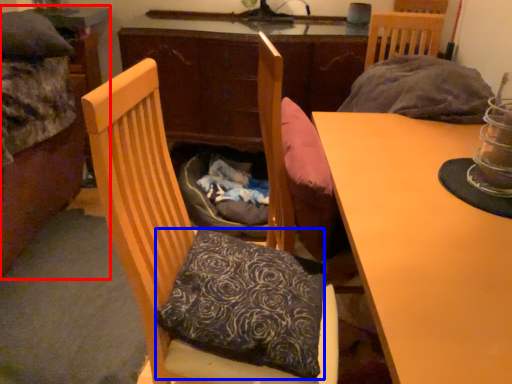
Question: Among these objects, which one is nearest to the camera, bed (highlighted by a red box) or pillow (highlighted by a blue box)?

Choices:
 (A) bed
 (B) pillow

Answer: (B)